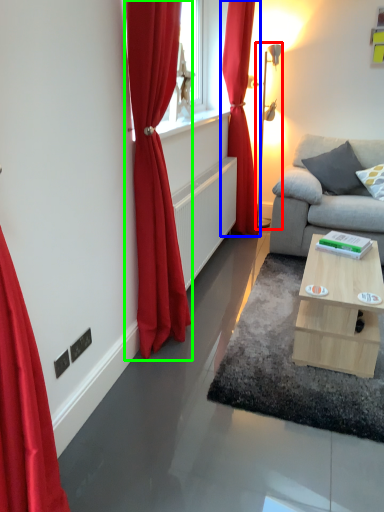
Question: Considering the real-world distances, which object is closest to table lamp (highlighted by a red box)? curtain (highlighted by a blue box) or curtain (highlighted by a green box).

Choices:
 (A) curtain
 (B) curtain

Answer: (A)